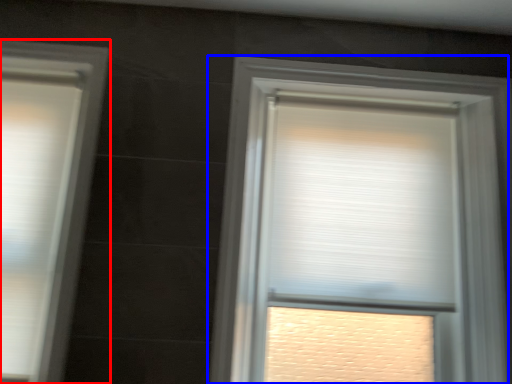
Question: Which point is further to the camera, window (highlighted by a red box) or window (highlighted by a blue box)?

Choices:
 (A) window
 (B) window

Answer: (B)